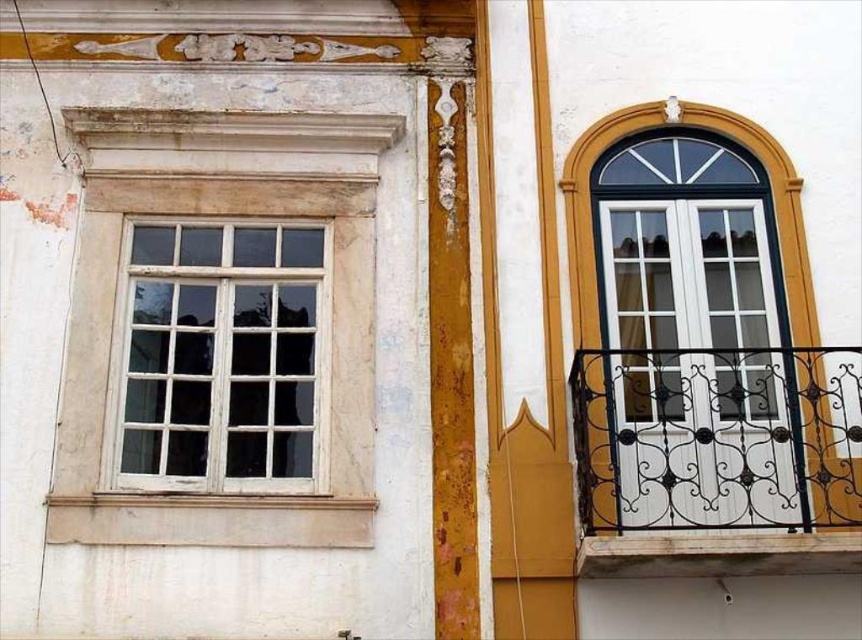
Question: Does white wrought iron balcony at right have a greater width compared to white wooden window at left?

Choices:
 (A) no
 (B) yes

Answer: (B)

Question: Which point appears farthest from the camera in this image?

Choices:
 (A) (197, 276)
 (B) (734, 365)

Answer: (A)

Question: Does white wrought iron balcony at right have a greater width compared to white wooden window at left?

Choices:
 (A) no
 (B) yes

Answer: (B)

Question: Is white wrought iron balcony at right smaller than white wooden window at left?

Choices:
 (A) no
 (B) yes

Answer: (A)

Question: Among these objects, which one is farthest from the camera?

Choices:
 (A) white wooden window at left
 (B) white wrought iron balcony at right

Answer: (A)